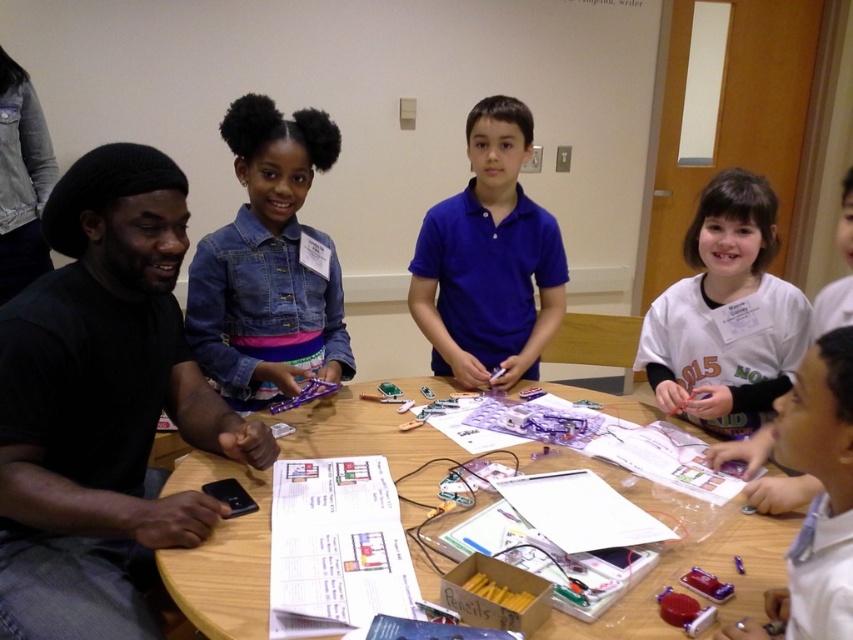
Question: Is white cotton shirt at upper right bigger than white glossy shirt at lower right?

Choices:
 (A) no
 (B) yes

Answer: (B)

Question: Which point is farther from the camera taking this photo?

Choices:
 (A) (415, 493)
 (B) (294, 202)
 (C) (833, 588)

Answer: (B)

Question: Is denim jacket at upper left bigger than blue matte shirt at center?

Choices:
 (A) yes
 (B) no

Answer: (B)

Question: Estimate the real-world distances between objects in this image. Which object is closer to the white glossy shirt at lower right?

Choices:
 (A) wooden table at center
 (B) denim jacket at upper left

Answer: (A)

Question: Which object is the farthest from the wooden table at center?

Choices:
 (A) blue matte shirt at center
 (B) white cotton shirt at upper right
 (C) white glossy shirt at lower right
 (D) denim jacket at upper left

Answer: (B)

Question: Is denim jacket at upper left to the right of white cotton shirt at upper right from the viewer's perspective?

Choices:
 (A) no
 (B) yes

Answer: (A)